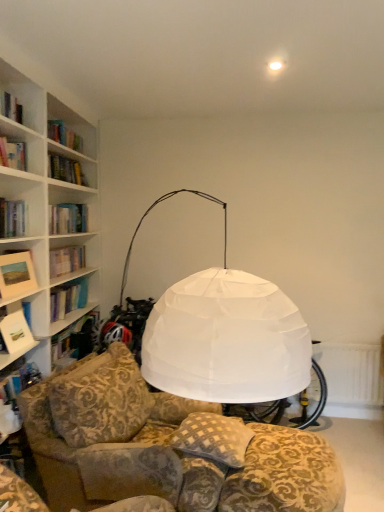
What do you see at coordinates (16, 333) in the screenshot?
I see `white paper book at left` at bounding box center [16, 333].

The height and width of the screenshot is (512, 384). Describe the element at coordinates (16, 274) in the screenshot. I see `matte white picture frame at left` at that location.

Measure the distance between point [211,428] and camera.

They are 2.25 meters apart.

Identify the location of white textured radiator at lower right. (351, 373).

From the image's perspective, which one is positioned lower, white textured radiator at lower right or white paper book at left?

white textured radiator at lower right.

Considering the sizes of objects white textured radiator at lower right and white paper book at left in the image provided, who is shorter, white textured radiator at lower right or white paper book at left?

white paper book at left is shorter.

Does white textured radiator at lower right appear on the right side of white paper book at left?

Correct, you'll find white textured radiator at lower right to the right of white paper book at left.

Is point (374, 362) farther from camera compared to point (18, 319)?

Yes, point (374, 362) is farther from viewer.

Can you confirm if checkered fabric pillow at center is bigger than white textured radiator at lower right?

Yes, checkered fabric pillow at center is bigger than white textured radiator at lower right.

How far apart are checkered fabric pillow at center and white textured radiator at lower right?

checkered fabric pillow at center and white textured radiator at lower right are 5.13 feet apart.

From the image's perspective, which is above, checkered fabric pillow at center or white textured radiator at lower right?

From the image's view, checkered fabric pillow at center is above.

Which is more to the left, checkered fabric pillow at center or white textured radiator at lower right?

checkered fabric pillow at center.

Does checkered fabric pillow at center turn towards white paper book at left?

No, checkered fabric pillow at center is not oriented towards white paper book at left.

Between checkered fabric pillow at center and white paper book at left, which one has smaller size?

Smaller between the two is white paper book at left.

Is checkered fabric pillow at center in front of white paper book at left?

Yes, checkered fabric pillow at center is closer to the viewer.

What's the angular difference between checkered fabric pillow at center and white paper book at left's facing directions?

There is a 12.3-degree angle between the facing directions of checkered fabric pillow at center and white paper book at left.

Which of these two, checkered fabric pillow at center or matte white picture frame at left, stands taller?

Standing taller between the two is matte white picture frame at left.

From the image's perspective, which one is positioned lower, checkered fabric pillow at center or matte white picture frame at left?

checkered fabric pillow at center.

Which object is positioned more to the left, checkered fabric pillow at center or matte white picture frame at left?

From the viewer's perspective, matte white picture frame at left appears more on the left side.

In the scene shown: Is the depth of checkered fabric pillow at center less than that of matte white picture frame at left?

Yes, checkered fabric pillow at center is closer to the camera.

Which is behind, matte white picture frame at left or white textured radiator at lower right?

white textured radiator at lower right is further away from the camera.

Between matte white picture frame at left and white textured radiator at lower right, which one has larger width?

matte white picture frame at left is wider.

Is matte white picture frame at left oriented towards white textured radiator at lower right?

No, matte white picture frame at left is not turned towards white textured radiator at lower right.

Does point (18, 262) lie behind point (382, 398)?

No.

Is matte white picture frame at left bigger or smaller than white paper book at left?

matte white picture frame at left is bigger than white paper book at left.

Is point (10, 270) closer to camera compared to point (27, 333)?

Yes, point (10, 270) is in front of point (27, 333).

Is white paper book at left located within matte white picture frame at left?

No, matte white picture frame at left does not contain white paper book at left.

This screenshot has width=384, height=512. In the image, there is a matte white picture frame at left. In order to click on book below it (from the image's perspective) in this screenshot , I will do `click(16, 333)`.

From the image's perspective, which one is positioned lower, white paper book at left or white textured radiator at lower right?

white textured radiator at lower right.

From the picture: Which of these two, white paper book at left or white textured radiator at lower right, stands shorter?

Standing shorter between the two is white paper book at left.

Is white paper book at left thinner than white textured radiator at lower right?

Incorrect, the width of white paper book at left is not less than that of white textured radiator at lower right.

From a real-world perspective, relative to white textured radiator at lower right, is white paper book at left vertically above or below?

white paper book at left is situated higher than white textured radiator at lower right in the real world.

Where is `book located above the white textured radiator at lower right (from the image's perspective)`? The width and height of the screenshot is (384, 512). book located above the white textured radiator at lower right (from the image's perspective) is located at coordinates (16, 333).

Find the location of a particular element. This screenshot has height=512, width=384. radiator located on the right of checkered fabric pillow at center is located at coordinates (351, 373).

From the picture: Based on their spatial positions, is white paper book at left or checkered fabric pillow at center closer to white textured radiator at lower right?

checkered fabric pillow at center lies closer to white textured radiator at lower right than the other object.

Which object lies further to the anchor point white textured radiator at lower right, checkered fabric pillow at center or matte white picture frame at left?

matte white picture frame at left is further to white textured radiator at lower right.

Looking at the image, which one is located closer to white paper book at left, white textured radiator at lower right or matte white picture frame at left?

matte white picture frame at left is positioned closer to the anchor white paper book at left.

From the picture: Considering their positions, is checkered fabric pillow at center positioned further to matte white picture frame at left than white textured radiator at lower right?

Based on the image, white textured radiator at lower right appears to be further to matte white picture frame at left.

From the image, which object appears to be farther from checkered fabric pillow at center, white textured radiator at lower right or white paper book at left?

Among the two, white textured radiator at lower right is located further to checkered fabric pillow at center.

Estimate the real-world distances between objects in this image. Which object is closer to white textured radiator at lower right, white paper book at left or matte white picture frame at left?

white paper book at left is closer to white textured radiator at lower right.

Looking at the image, which one is located further to white textured radiator at lower right, matte white picture frame at left or white paper book at left?

The object further to white textured radiator at lower right is matte white picture frame at left.

Which object lies further to the anchor point matte white picture frame at left, white paper book at left or checkered fabric pillow at center?

The object further to matte white picture frame at left is checkered fabric pillow at center.

Where is `pillow between matte white picture frame at left and white textured radiator at lower right from left to right`? The width and height of the screenshot is (384, 512). pillow between matte white picture frame at left and white textured radiator at lower right from left to right is located at coordinates (213, 438).

Where is `picture frame situated between white paper book at left and white textured radiator at lower right from left to right`? This screenshot has height=512, width=384. picture frame situated between white paper book at left and white textured radiator at lower right from left to right is located at coordinates (16, 274).

The width and height of the screenshot is (384, 512). What are the coordinates of `picture frame located between white paper book at left and checkered fabric pillow at center in the left-right direction` in the screenshot? It's located at (16, 274).

I want to click on pillow between white paper book at left and white textured radiator at lower right from left to right, so click(x=213, y=438).